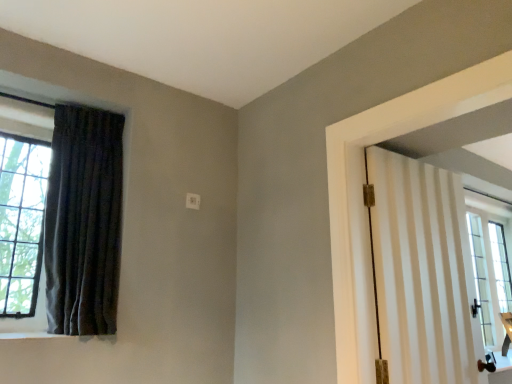
Question: Is white striped door at right surrounded by dark velvet curtain at left?

Choices:
 (A) yes
 (B) no

Answer: (B)

Question: Is dark velvet curtain at left facing towards white striped door at right?

Choices:
 (A) yes
 (B) no

Answer: (B)

Question: Does dark velvet curtain at left come in front of white striped door at right?

Choices:
 (A) no
 (B) yes

Answer: (A)

Question: Considering the relative sizes of dark velvet curtain at left and white striped door at right in the image provided, is dark velvet curtain at left taller than white striped door at right?

Choices:
 (A) no
 (B) yes

Answer: (B)

Question: From a real-world perspective, is dark velvet curtain at left located beneath white striped door at right?

Choices:
 (A) no
 (B) yes

Answer: (A)

Question: Are dark velvet curtain at left and white striped door at right making contact?

Choices:
 (A) yes
 (B) no

Answer: (B)

Question: Considering the relative sizes of white striped door at right and dark velvet curtain at left in the image provided, is white striped door at right wider than dark velvet curtain at left?

Choices:
 (A) yes
 (B) no

Answer: (B)

Question: From a real-world perspective, is white striped door at right positioned over dark velvet curtain at left based on gravity?

Choices:
 (A) yes
 (B) no

Answer: (B)

Question: Is white striped door at right far from dark velvet curtain at left?

Choices:
 (A) yes
 (B) no

Answer: (A)

Question: Does white striped door at right turn towards dark velvet curtain at left?

Choices:
 (A) yes
 (B) no

Answer: (B)

Question: Is white striped door at right facing away from dark velvet curtain at left?

Choices:
 (A) yes
 (B) no

Answer: (B)

Question: Is white striped door at right in contact with dark velvet curtain at left?

Choices:
 (A) no
 (B) yes

Answer: (A)

Question: In terms of height, does dark velvet curtain at left look taller or shorter compared to white striped door at right?

Choices:
 (A) tall
 (B) short

Answer: (A)